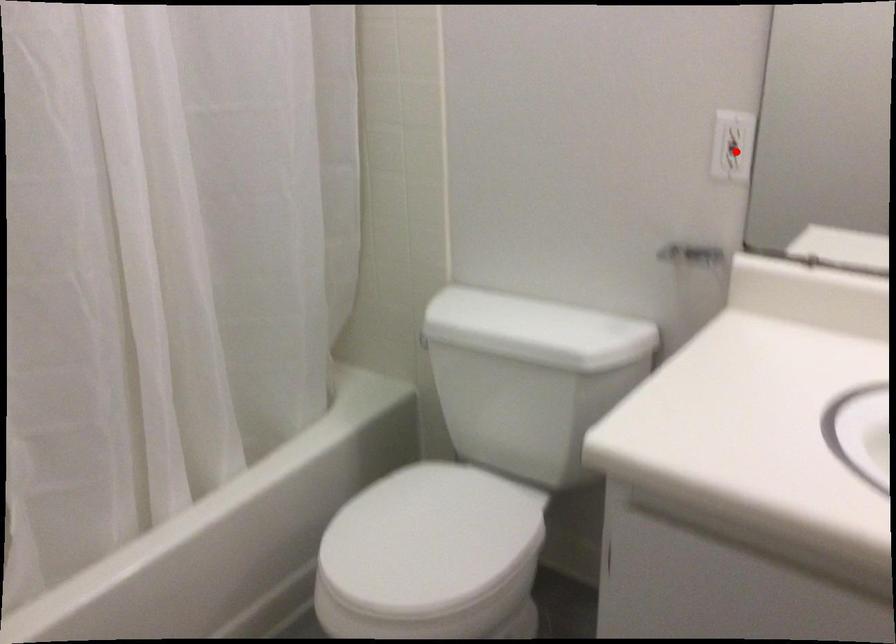
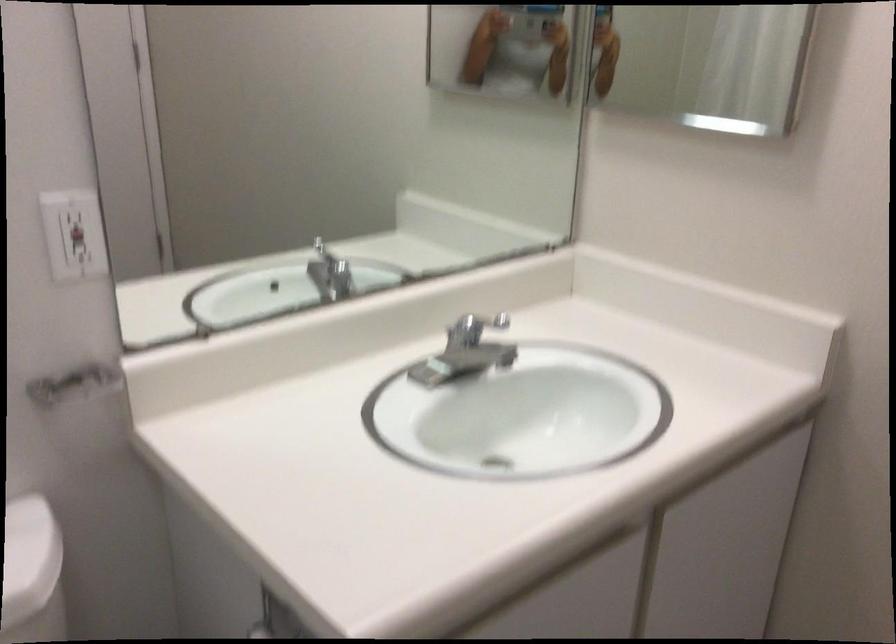
In the second image, find the point that corresponds to the highlighted location in the first image.

(76, 234)